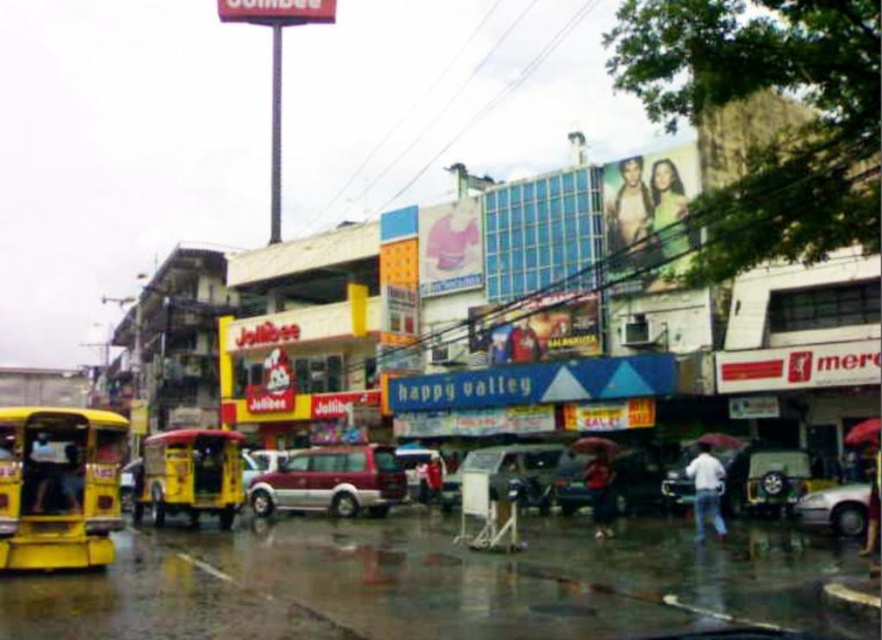
Can you confirm if green fabric person at upper right is smaller than skinny jeans at upper center?

No, green fabric person at upper right is not smaller than skinny jeans at upper center.

Based on the photo, can you confirm if green fabric person at upper right is bigger than skinny jeans at upper center?

Yes.

Describe the element at coordinates (669, 225) in the screenshot. The height and width of the screenshot is (640, 882). I see `green fabric person at upper right` at that location.

Locate an element on the screen. green fabric person at upper right is located at coordinates (669, 225).

Can you confirm if maroon metallic van at center is bigger than green fabric person at upper right?

Yes, maroon metallic van at center is bigger than green fabric person at upper right.

Does maroon metallic van at center appear under green fabric person at upper right?

Indeed, maroon metallic van at center is positioned under green fabric person at upper right.

At what (x,y) coordinates should I click in order to perform the action: click on maroon metallic van at center. Please return your answer as a coordinate pair (x, y). The image size is (882, 640). Looking at the image, I should click on (331, 481).

Which is more to the right, dark blue jeans at lower right or red fabric umbrella at center?

dark blue jeans at lower right

Looking at this image, which is above, dark blue jeans at lower right or red fabric umbrella at center?

red fabric umbrella at center is above.

What do you see at coordinates (872, 509) in the screenshot? The width and height of the screenshot is (882, 640). I see `dark blue jeans at lower right` at bounding box center [872, 509].

This screenshot has width=882, height=640. What are the coordinates of `dark blue jeans at lower right` in the screenshot? It's located at point(872,509).